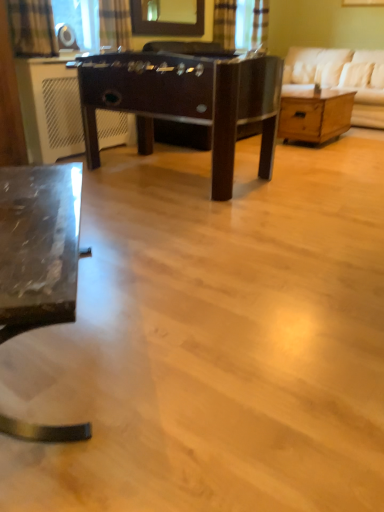
The width and height of the screenshot is (384, 512). Identify the location of free space above metallic glass desk at lower left (from a real-world perspective). (29, 212).